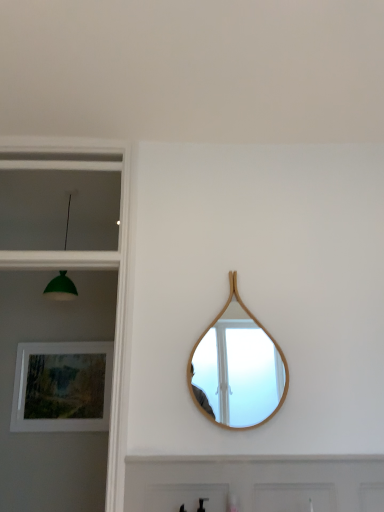
Question: From a real-world perspective, is green matte lampshade at left located higher than wooden mirror at center?

Choices:
 (A) yes
 (B) no

Answer: (A)

Question: Is green matte lampshade at left at the left side of wooden mirror at center?

Choices:
 (A) yes
 (B) no

Answer: (A)

Question: Is wooden mirror at center at the back of green matte lampshade at left?

Choices:
 (A) no
 (B) yes

Answer: (A)

Question: Can you confirm if green matte lampshade at left is smaller than wooden mirror at center?

Choices:
 (A) no
 (B) yes

Answer: (A)

Question: Does green matte lampshade at left have a greater height compared to wooden mirror at center?

Choices:
 (A) yes
 (B) no

Answer: (B)

Question: Considering the positions of point (91, 357) and point (130, 483), is point (91, 357) closer or farther from the camera than point (130, 483)?

Choices:
 (A) farther
 (B) closer

Answer: (A)

Question: From a real-world perspective, relative to white painted wood door at lower center, is matte wooden picture frame at lower left vertically above or below?

Choices:
 (A) above
 (B) below

Answer: (A)

Question: From the image's perspective, is matte wooden picture frame at lower left above or below white painted wood door at lower center?

Choices:
 (A) above
 (B) below

Answer: (A)

Question: In the image, is matte wooden picture frame at lower left positioned in front of or behind white painted wood door at lower center?

Choices:
 (A) behind
 (B) front

Answer: (A)

Question: In terms of width, does matte glass window at upper left look wider or thinner when compared to green matte lampshade at left?

Choices:
 (A) wide
 (B) thin

Answer: (B)

Question: Do you think matte glass window at upper left is within green matte lampshade at left, or outside of it?

Choices:
 (A) outside
 (B) inside

Answer: (A)

Question: Would you say matte glass window at upper left is to the left or to the right of green matte lampshade at left in the picture?

Choices:
 (A) right
 (B) left

Answer: (A)

Question: From their relative heights in the image, would you say matte glass window at upper left is taller or shorter than green matte lampshade at left?

Choices:
 (A) tall
 (B) short

Answer: (B)

Question: Is white painted wood door at lower center taller or shorter than wooden mirror at center?

Choices:
 (A) tall
 (B) short

Answer: (B)

Question: In the image, is white painted wood door at lower center on the left side or the right side of wooden mirror at center?

Choices:
 (A) left
 (B) right

Answer: (B)